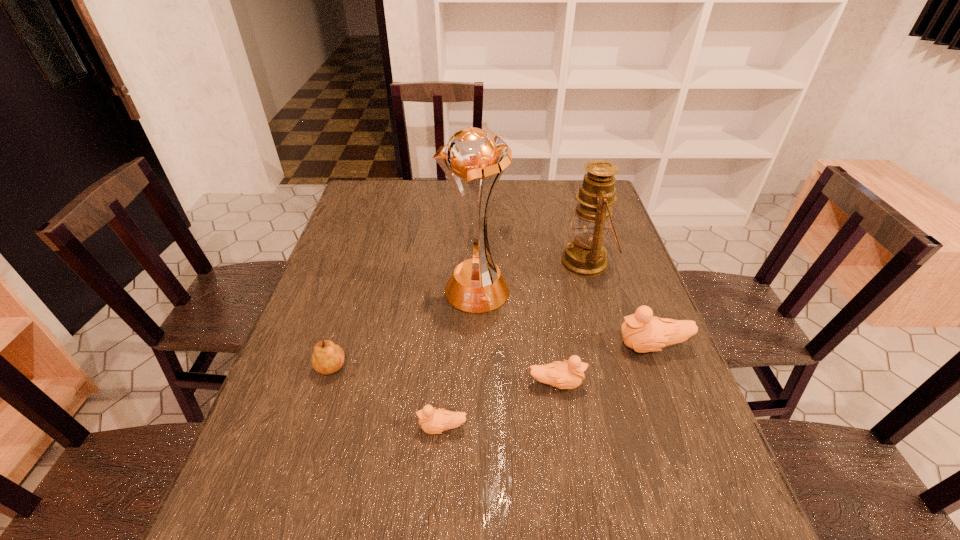
This screenshot has height=540, width=960. What are the coordinates of `free space located on the face of the nearest duckling` in the screenshot? It's located at (375, 428).

At what (x,y) coordinates should I click in order to perform the action: click on free location located 0.160m on the face of the nearest duckling. Please return your answer as a coordinate pair (x, y). The height and width of the screenshot is (540, 960). Looking at the image, I should click on (342, 428).

What are the coordinates of `free space located 0.180m on the face of the second farthest duckling` in the screenshot? It's located at point(663,384).

The height and width of the screenshot is (540, 960). I want to click on vacant area situated on the face of the third tallest object, so click(485, 347).

In order to click on vacant space located 0.240m on the face of the third tallest object in this screenshot , I will do `click(517, 347)`.

The image size is (960, 540). Identify the location of free space located 0.400m on the face of the third tallest object. (452, 347).

This screenshot has height=540, width=960. Identify the location of free location located on the front of the leftmost object. (308, 467).

Image resolution: width=960 pixels, height=540 pixels. I want to click on vacant space situated on the front-facing side of the trophy, so click(x=474, y=420).

Identify the location of vacant space located 0.280m on the front of the second tallest object. (616, 366).

What are the coordinates of `object located at the left edge` in the screenshot? It's located at (328, 357).